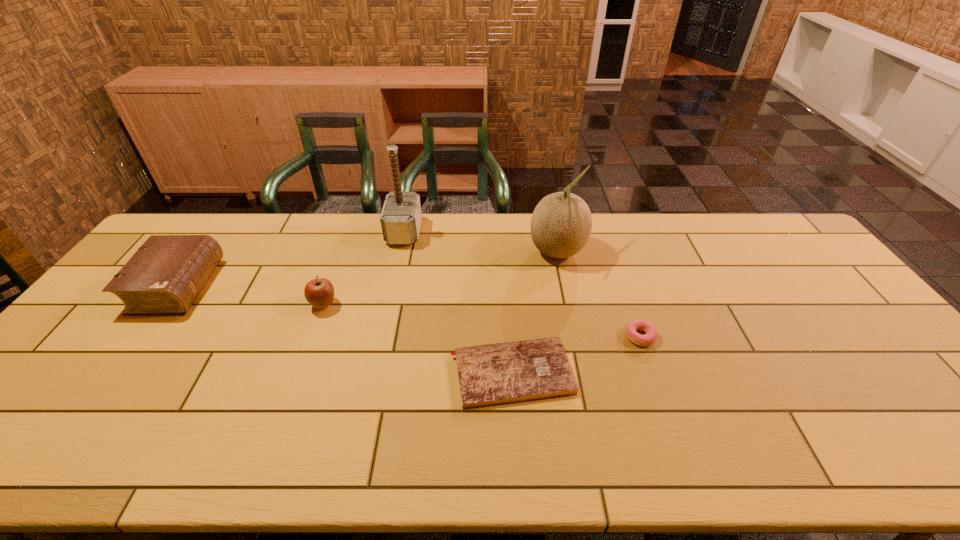
Locate an element on the screen. This screenshot has height=540, width=960. free spot between the nearer Bible and the left Bible is located at coordinates (345, 330).

Locate an element on the screen. Image resolution: width=960 pixels, height=540 pixels. free space between the apple and the left Bible is located at coordinates (251, 295).

Locate an element on the screen. This screenshot has height=540, width=960. unoccupied area between the doughnut and the right Bible is located at coordinates (575, 355).

Identify the location of the fifth closest object relative to the left Bible. (649, 338).

Where is `object that is the third closest to the apple`? object that is the third closest to the apple is located at coordinates (494, 374).

Identify the location of free spot that satisfies the following two spatial constraints: 1. on the back side of the right Bible; 2. for striking with the head of the tallest object. This screenshot has width=960, height=540. (502, 232).

The image size is (960, 540). Identify the location of vacant space that satisfies the following two spatial constraints: 1. on the spine side of the second object from left to right; 2. on the left side of the farther Bible. (164, 305).

At what (x,y) coordinates should I click in order to perform the action: click on free space that satisfies the following two spatial constraints: 1. for striking with the head of the right Bible; 2. on the left side of the tallest object. Please return your answer as a coordinate pair (x, y). This screenshot has width=960, height=540. Looking at the image, I should click on (373, 373).

Where is `blank space that satisfies the following two spatial constraints: 1. on the spine side of the shortest object; 2. on the right side of the farther Bible`? The width and height of the screenshot is (960, 540). blank space that satisfies the following two spatial constraints: 1. on the spine side of the shortest object; 2. on the right side of the farther Bible is located at coordinates (113, 373).

Identify the location of free point that satisfies the following two spatial constraints: 1. for striking with the head of the cantaloup; 2. on the left side of the tallest object. (399, 253).